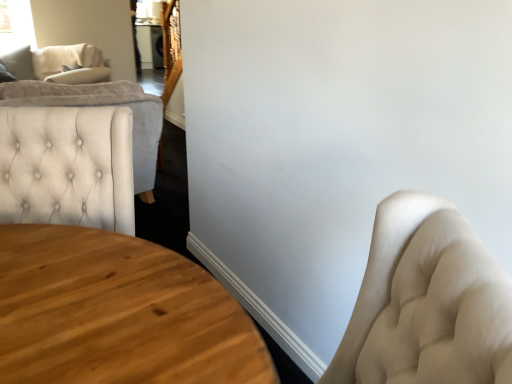
The image size is (512, 384). What do you see at coordinates (57, 63) in the screenshot?
I see `tufted fabric chair at upper left` at bounding box center [57, 63].

At what (x,y) coordinates should I click in order to perform the action: click on tufted fabric chair at upper left. Please return your answer as a coordinate pair (x, y). This screenshot has height=384, width=512. Looking at the image, I should click on (57, 63).

Find the location of a particular element. Image resolution: width=512 pixels, height=384 pixels. tufted fabric chair at upper left is located at coordinates (57, 63).